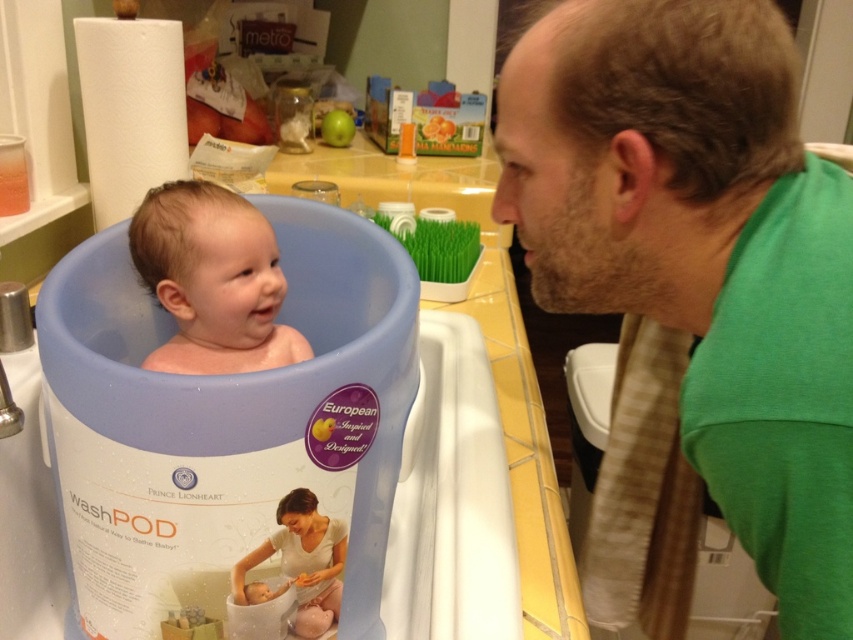
Question: Estimate the real-world distances between objects in this image. Which object is closer to the soft white fabric baby at center?

Choices:
 (A) green fabric shirt at upper right
 (B) white plastic sink at lower center
 (C) smooth plastic baby in tub at left

Answer: (B)

Question: Can you confirm if white plastic sink at lower center is positioned below soft white fabric baby at center?

Choices:
 (A) yes
 (B) no

Answer: (B)

Question: Which object is farther from the camera taking this photo?

Choices:
 (A) white plastic sink at lower center
 (B) smooth plastic baby in tub at left
 (C) green fabric shirt at upper right

Answer: (B)

Question: Is green fabric shirt at upper right positioned in front of smooth plastic baby in tub at left?

Choices:
 (A) no
 (B) yes

Answer: (B)

Question: Does green fabric shirt at upper right have a greater width compared to smooth plastic baby in tub at left?

Choices:
 (A) yes
 (B) no

Answer: (A)

Question: Which object appears farthest from the camera in this image?

Choices:
 (A) smooth plastic baby in tub at left
 (B) white plastic sink at lower center
 (C) soft white fabric baby at center

Answer: (A)